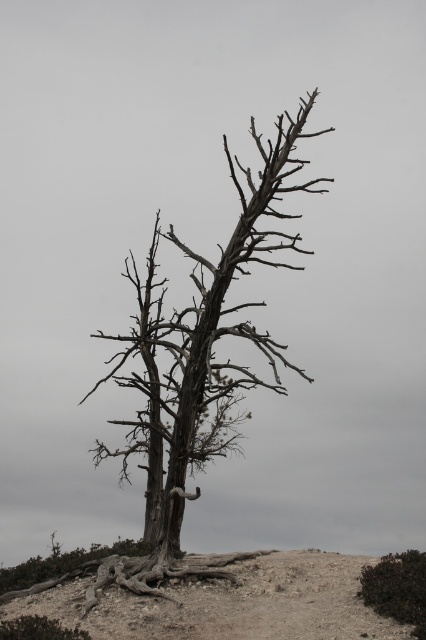
Which of these two, gray bark tree at center or brown sandy soil at lower center, stands shorter?

Standing shorter between the two is brown sandy soil at lower center.

The height and width of the screenshot is (640, 426). Describe the element at coordinates (204, 337) in the screenshot. I see `gray bark tree at center` at that location.

I want to click on gray bark tree at center, so click(204, 337).